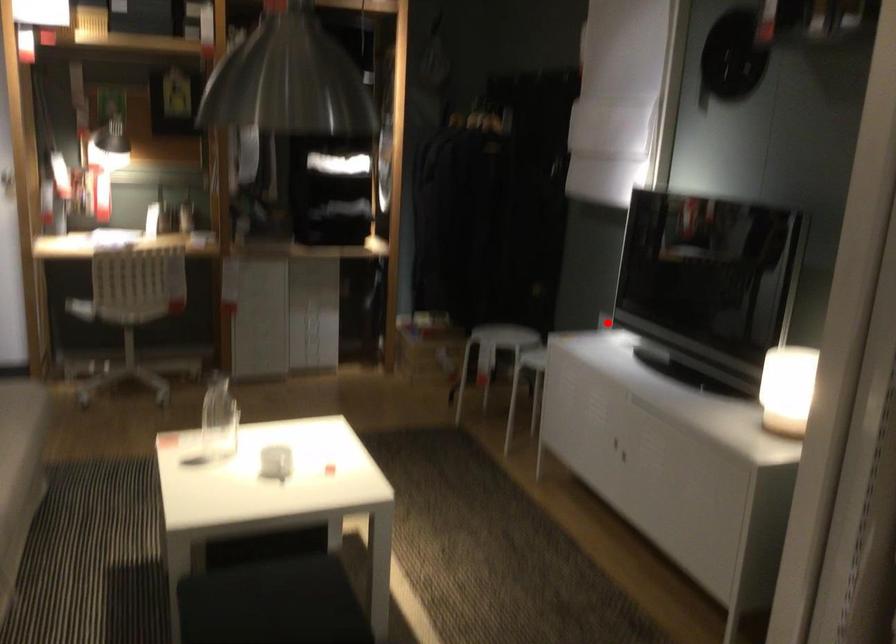
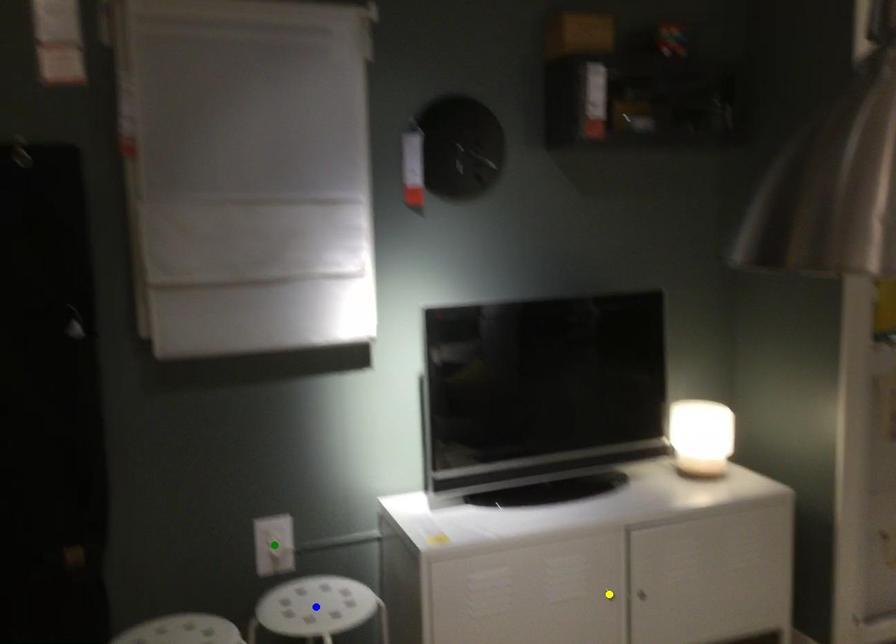
Question: I am providing you with two images of the same scene from different viewpoints. A red point is marked on the first image. You are given multiple points on the second image. Which spot in image 2 lines up with the point in image 1?

Choices:
 (A) blue point
 (B) green point
 (C) yellow point

Answer: (B)